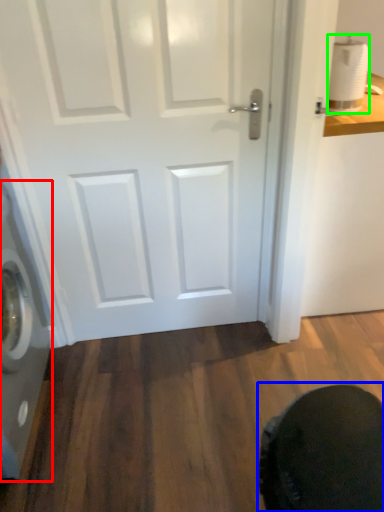
Question: Considering the real-world distances, which object is farthest from washing machine (highlighted by a red box)? swivel chair (highlighted by a blue box) or toilet paper (highlighted by a green box)?

Choices:
 (A) swivel chair
 (B) toilet paper

Answer: (B)